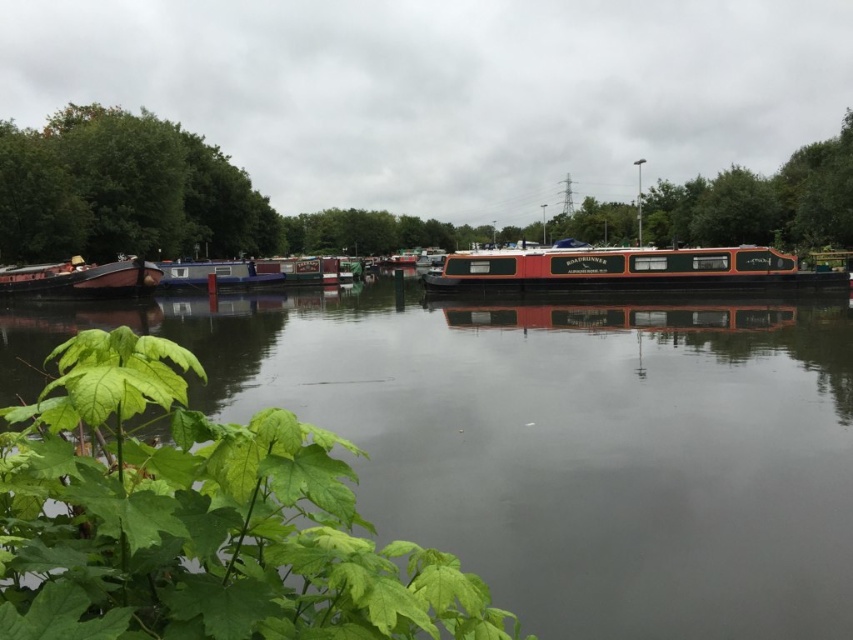
Does matte black houseboat at center have a greater height compared to wooden boat at left?

No, matte black houseboat at center is not taller than wooden boat at left.

Between point (631, 285) and point (26, 289), which one is positioned in front?

Positioned in front is point (631, 285).

The width and height of the screenshot is (853, 640). I want to click on matte black houseboat at center, so click(x=614, y=269).

What do you see at coordinates (125, 189) in the screenshot? I see `green leafy tree at left` at bounding box center [125, 189].

Which is behind, point (33, 230) or point (337, 278)?

Point (337, 278)

Image resolution: width=853 pixels, height=640 pixels. What do you see at coordinates (125, 189) in the screenshot?
I see `green leafy tree at left` at bounding box center [125, 189].

You are a GUI agent. You are given a task and a screenshot of the screen. Output one action in this format:
    pyautogui.click(x=<x>, y=<y>)
    Task: Click on the green leafy tree at left
    
    Given the screenshot: What is the action you would take?
    pyautogui.click(x=125, y=189)

Does green leafy tree at center come behind wooden boat at left?

That is True.

Which is behind, point (178, 204) or point (73, 269)?

Point (178, 204)

Locate an element on the screen. Image resolution: width=853 pixels, height=640 pixels. green leafy tree at center is located at coordinates (165, 198).

Find the location of a particular element. Image resolution: width=853 pixels, height=640 pixels. green leafy tree at center is located at coordinates (165, 198).